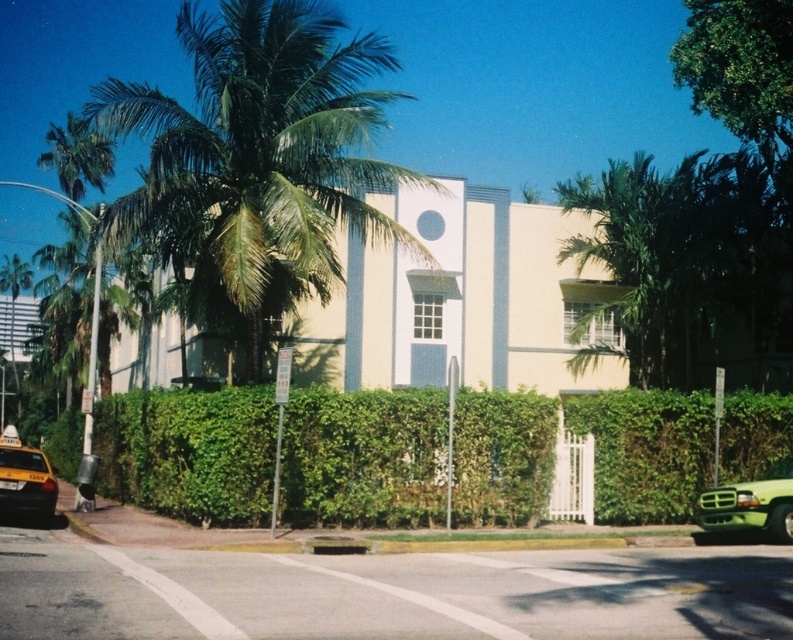
Question: Is green leafy hedge at center thinner than yellow matte taxi at lower left?

Choices:
 (A) yes
 (B) no

Answer: (B)

Question: Which of the following is the closest to the observer?

Choices:
 (A) (738, 509)
 (B) (6, 490)
 (C) (772, 472)
 (D) (691, 289)

Answer: (A)

Question: Considering the real-world distances, which object is closest to the green leafy palm tree at upper left?

Choices:
 (A) yellow matte taxi at lower left
 (B) green leafy hedge at center
 (C) green leafy palm tree at right

Answer: (B)

Question: Can you confirm if green leafy palm tree at upper left is wider than green matte truck at lower right?

Choices:
 (A) yes
 (B) no

Answer: (A)

Question: Which point is closer to the camera taking this photo?

Choices:
 (A) (255, 221)
 (B) (427, 490)
 (C) (44, 470)
 (D) (698, 237)

Answer: (A)

Question: Can you confirm if green matte truck at lower right is bigger than yellow matte taxi at lower left?

Choices:
 (A) no
 (B) yes

Answer: (A)